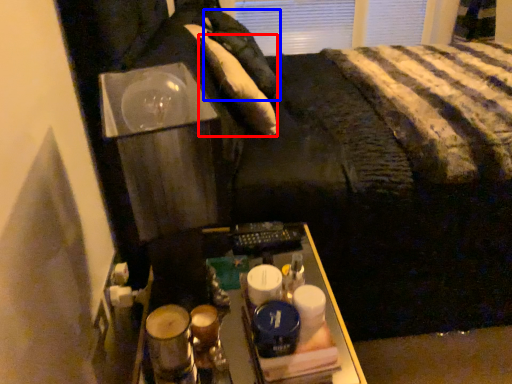
Question: Which point is closer to the camera, pillow (highlighted by a red box) or pillow (highlighted by a blue box)?

Choices:
 (A) pillow
 (B) pillow

Answer: (A)